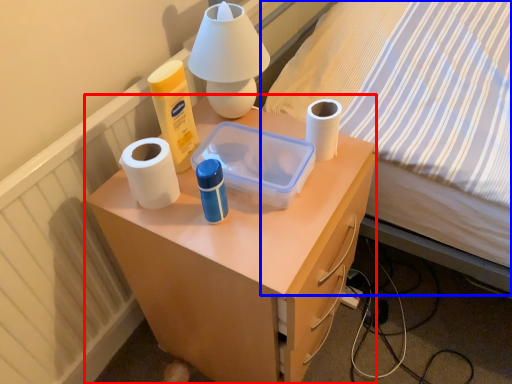
Question: Among these objects, which one is nearest to the camera, desk (highlighted by a red box) or bed (highlighted by a blue box)?

Choices:
 (A) desk
 (B) bed

Answer: (B)